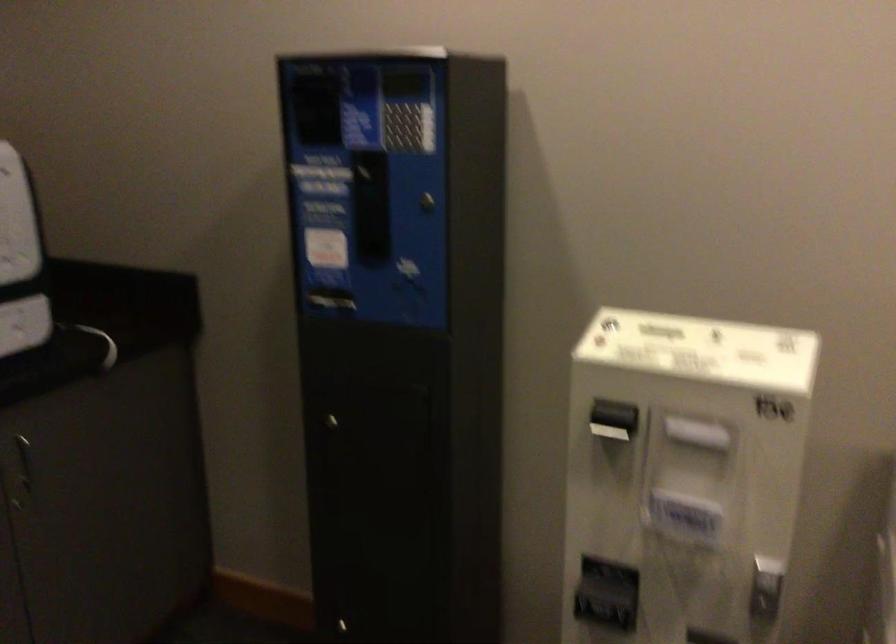
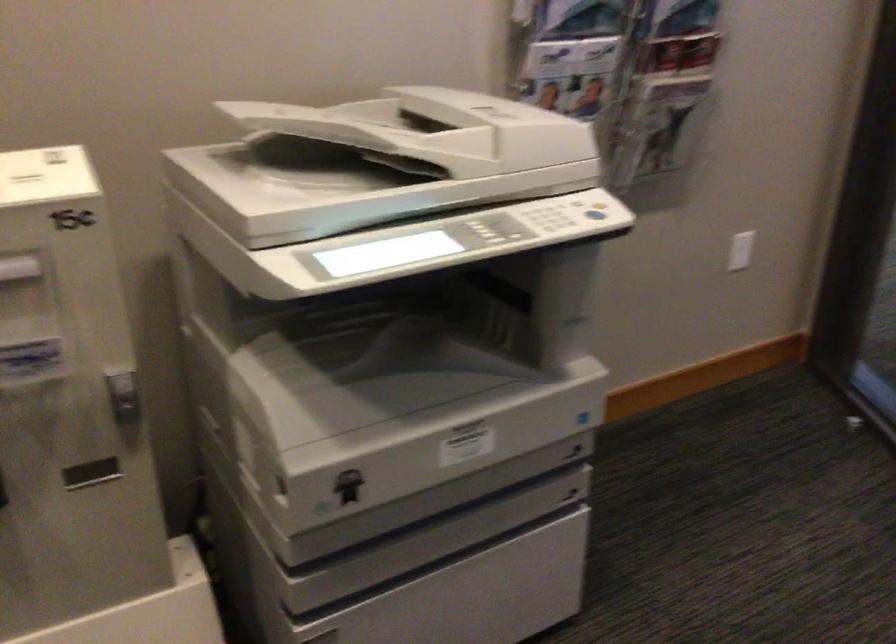
First-person continuous shooting, in which direction is the camera rotating?

The camera rotated toward right-down.